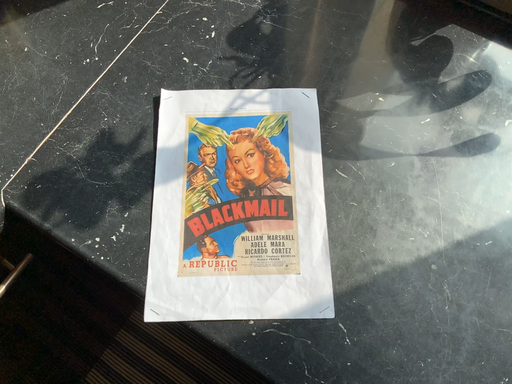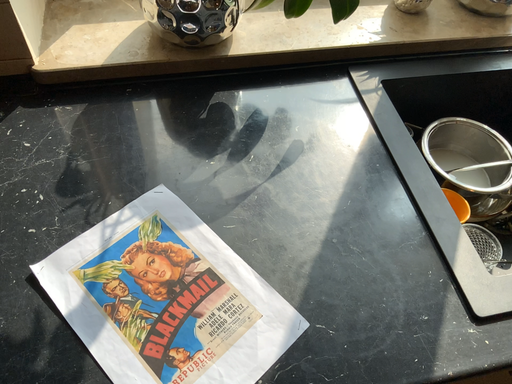
Question: Which way did the camera rotate in the video?

Choices:
 (A) rotated downward
 (B) rotated upward

Answer: (B)